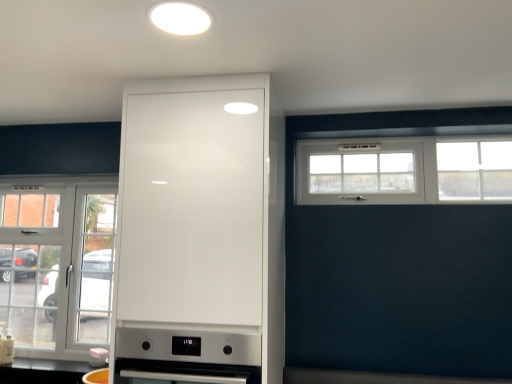
Question: Is white plastic window at upper right, which is the 2th window from left to right, touching satin silver oven at center, which ranks as the 1th appliance in right-to-left order?

Choices:
 (A) yes
 (B) no

Answer: (B)

Question: Can you confirm if white plastic window at upper right, acting as the first window starting from the top, is wider than satin silver oven at center, marked as the 2th appliance in a back-to-front arrangement?

Choices:
 (A) no
 (B) yes

Answer: (A)

Question: From a real-world perspective, does white plastic window at upper right, positioned as the first window in right-to-left order, stand above satin silver oven at center, positioned as the 1th appliance in top-to-bottom order?

Choices:
 (A) yes
 (B) no

Answer: (A)

Question: Does white plastic window at upper right, which appears as the 2th window when ordered from the bottom, turn towards satin silver oven at center, which is the 2th appliance from bottom to top?

Choices:
 (A) no
 (B) yes

Answer: (A)

Question: Is satin silver oven at center, which is the 1th appliance in front-to-back order, surrounded by white plastic window at upper right, positioned as the first window in right-to-left order?

Choices:
 (A) yes
 (B) no

Answer: (B)

Question: From the image's perspective, would you say white plastic window at upper right, acting as the first window starting from the top, is shown under satin silver oven at center, positioned as the 1th appliance in top-to-bottom order?

Choices:
 (A) yes
 (B) no

Answer: (B)

Question: From a real-world perspective, is white matte light fixture at upper center positioned over matte white kettle at lower center, placed as the second appliance when sorted from right to left, based on gravity?

Choices:
 (A) no
 (B) yes

Answer: (B)

Question: Is the position of white matte light fixture at upper center more distant than that of matte white kettle at lower center, arranged as the first appliance when viewed from the left?

Choices:
 (A) no
 (B) yes

Answer: (A)

Question: Can you confirm if white matte light fixture at upper center is thinner than matte white kettle at lower center, the 1th appliance positioned from the back?

Choices:
 (A) yes
 (B) no

Answer: (B)

Question: Is white matte light fixture at upper center aimed at matte white kettle at lower center, which is the 2th appliance in front-to-back order?

Choices:
 (A) no
 (B) yes

Answer: (A)

Question: From the image's perspective, is white matte light fixture at upper center over matte white kettle at lower center, placed as the second appliance when sorted from right to left?

Choices:
 (A) yes
 (B) no

Answer: (A)

Question: Is white matte light fixture at upper center facing away from matte white kettle at lower center, the 1th appliance positioned from the back?

Choices:
 (A) yes
 (B) no

Answer: (B)

Question: From the image's perspective, is matte white kettle at lower center, arranged as the first appliance when viewed from the left, beneath white plastic window at upper right, which is the 2th window from left to right?

Choices:
 (A) no
 (B) yes

Answer: (B)